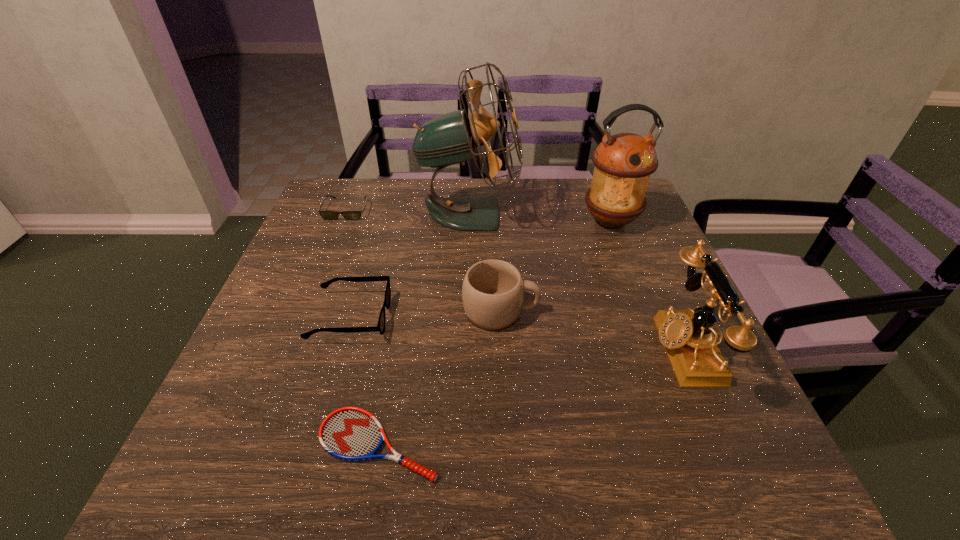
In the image, there is a desktop. What are the coordinates of `blank space at the right edge` in the screenshot? It's located at (664, 360).

At what (x,y) coordinates should I click in order to perform the action: click on vacant space that's between the fan and the fifth tallest object. Please return your answer as a coordinate pair (x, y). The height and width of the screenshot is (540, 960). Looking at the image, I should click on [x=410, y=265].

Locate an element on the screen. The width and height of the screenshot is (960, 540). free space between the mug and the third tallest object is located at coordinates (592, 329).

Where is `vacant point located between the nearest object and the spectacles`? The height and width of the screenshot is (540, 960). vacant point located between the nearest object and the spectacles is located at coordinates [x=365, y=381].

I want to click on vacant area between the oil lamp and the third tallest object, so click(647, 285).

At what (x,y) coordinates should I click in order to perform the action: click on free spot between the fan and the fifth shortest object. Please return your answer as a coordinate pair (x, y). This screenshot has height=540, width=960. Looking at the image, I should click on (576, 281).

Locate an element on the screen. empty space that is in between the tennis racket and the telephone is located at coordinates (531, 396).

Where is `the fifth closest object relative to the tallest object`? the fifth closest object relative to the tallest object is located at coordinates (687, 336).

In order to click on the closest object to the spectacles in this screenshot , I will do `click(349, 433)`.

The width and height of the screenshot is (960, 540). What are the coordinates of `vacant area that satisfies the following two spatial constraints: 1. on the arms of the fifth tallest object; 2. on the left side of the nearest object` in the screenshot? It's located at pyautogui.click(x=313, y=444).